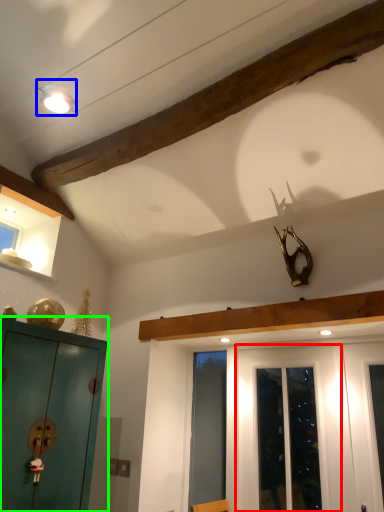
Question: Which object is the farthest from door (highlighted by a red box)? Choose among these: light fixture (highlighted by a blue box) or cabinetry (highlighted by a green box).

Choices:
 (A) light fixture
 (B) cabinetry

Answer: (A)